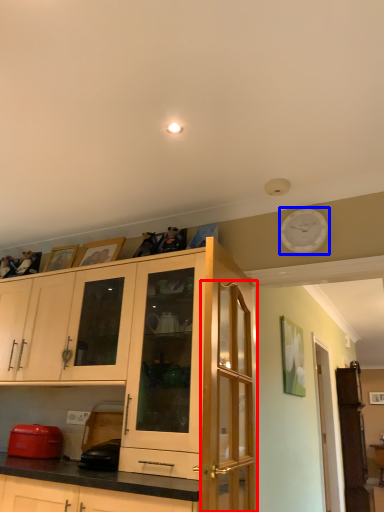
Question: Which object appears farthest to the camera in this image, glass door (highlighted by a red box) or clock (highlighted by a blue box)?

Choices:
 (A) glass door
 (B) clock

Answer: (B)